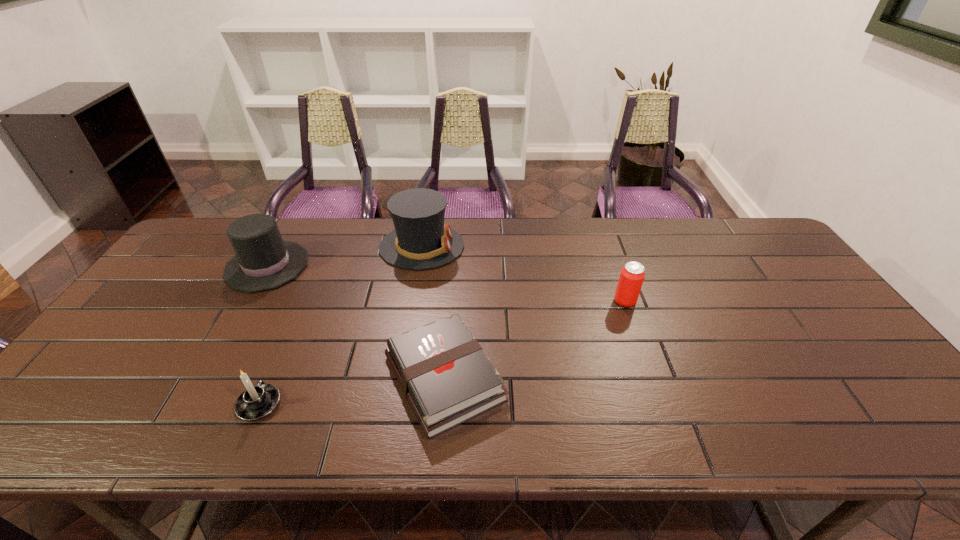
Identify the location of the right dress hat. The width and height of the screenshot is (960, 540). (421, 240).

Where is `the left dress hat`? the left dress hat is located at coordinates (263, 261).

This screenshot has width=960, height=540. Find the location of `the rightmost object`. the rightmost object is located at coordinates (632, 275).

Identify the location of beer can. (632, 275).

You are a GUI agent. You are given a task and a screenshot of the screen. Output one action in this format:
    pyautogui.click(x=<x>, y=<y>)
    Task: Click on the candle holder
    This screenshot has width=960, height=540.
    Given the screenshot: What is the action you would take?
    pyautogui.click(x=256, y=402)

The width and height of the screenshot is (960, 540). I want to click on the shortest object, so click(446, 376).

At what (x,y) coordinates should I click in order to perform the action: click on free region located 0.220m with goggles on the front of the right dress hat. Please return your answer as a coordinate pair (x, y). This screenshot has height=540, width=960. Looking at the image, I should click on (532, 247).

Locate an element on the screen. The width and height of the screenshot is (960, 540). vacant region located on the front of the left dress hat with the decoration is located at coordinates (366, 266).

Find the location of a particular element. vacant area situated 0.060m on the left of the rightmost object is located at coordinates (592, 301).

At what (x,y) coordinates should I click in order to perform the action: click on free spot located with a handle on the side of the candle holder. Please return your answer as a coordinate pair (x, y). Looking at the image, I should click on (284, 347).